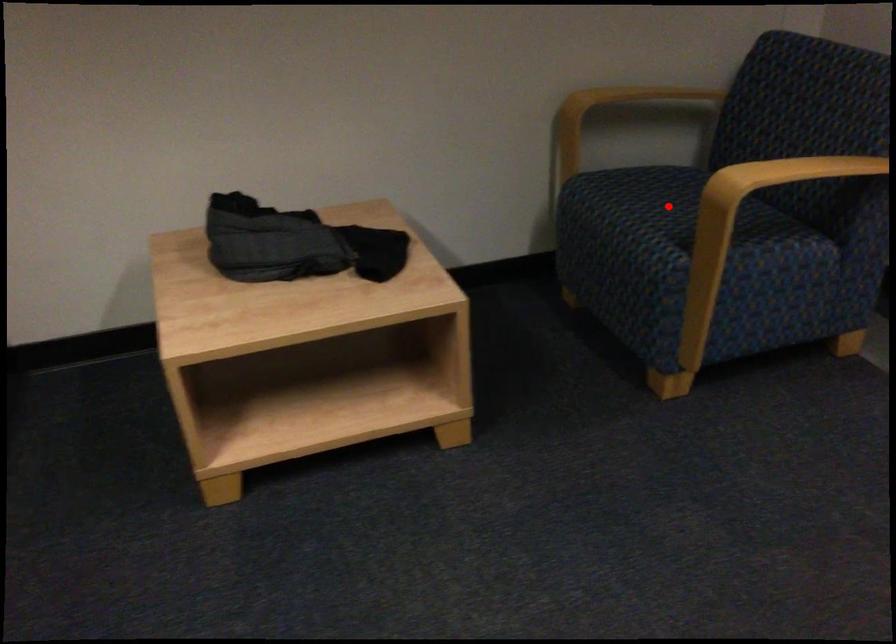
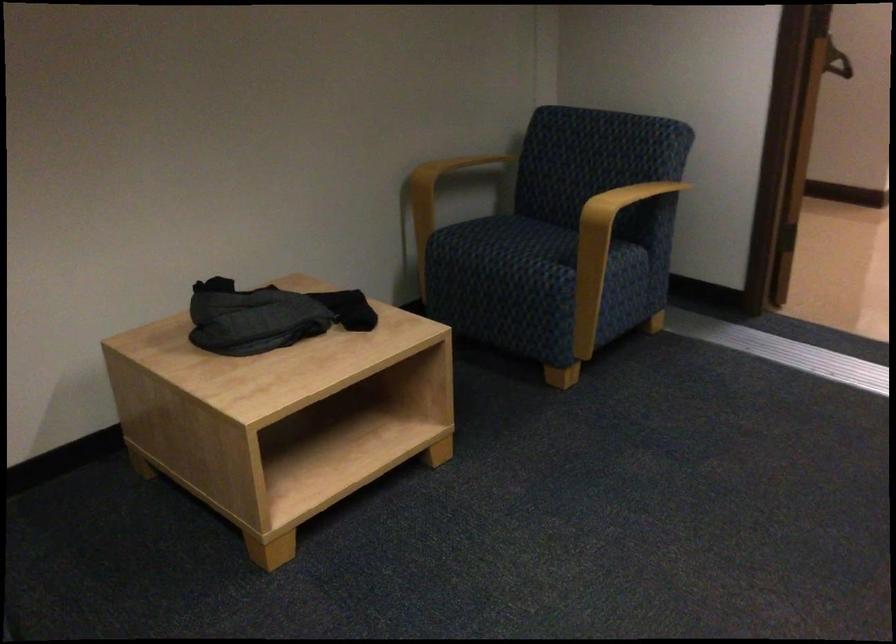
Question: I am providing you with two images of the same scene from different viewpoints. In image1, a red point is highlighted. Considering the same 3D point in image2, which of the following is correct?

Choices:
 (A) It is closer
 (B) It is farther

Answer: (B)